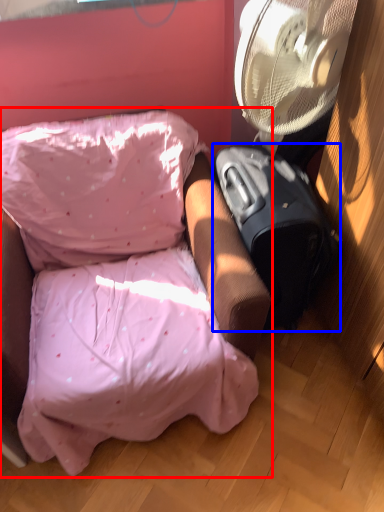
Question: Which object is closer to the camera taking this photo, furniture (highlighted by a red box) or luggage (highlighted by a blue box)?

Choices:
 (A) furniture
 (B) luggage

Answer: (A)